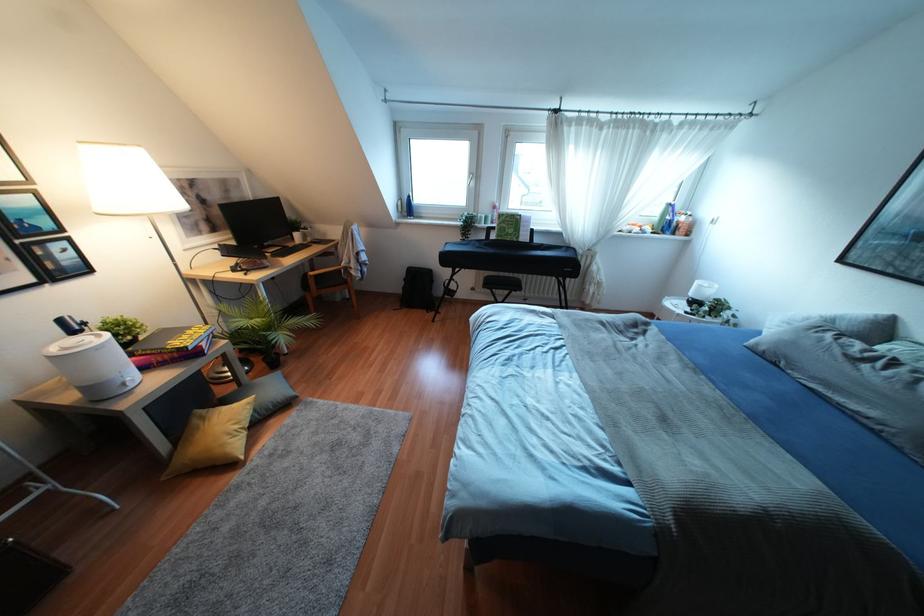
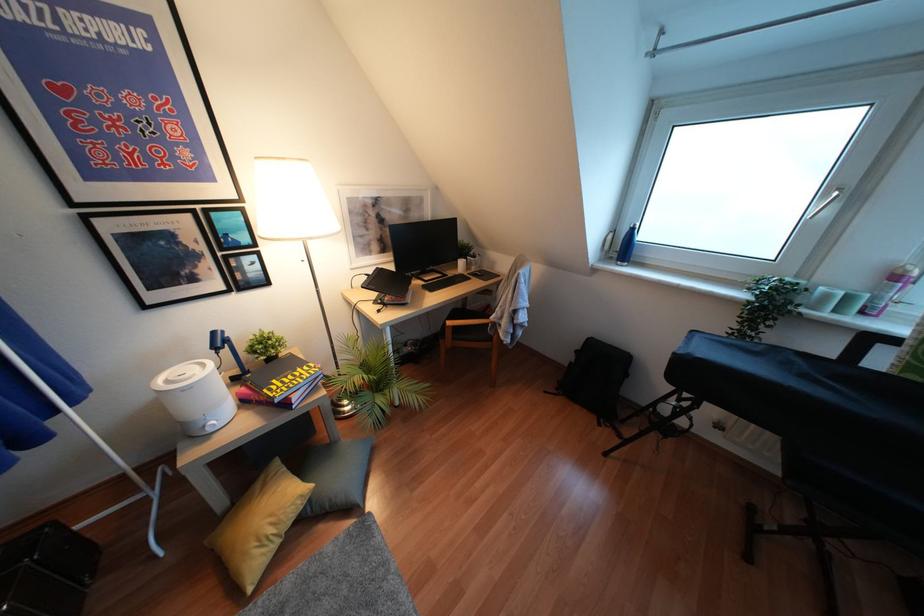
Locate, in the second image, the point that corresponds to (x=493, y=207) in the first image.

(895, 277)